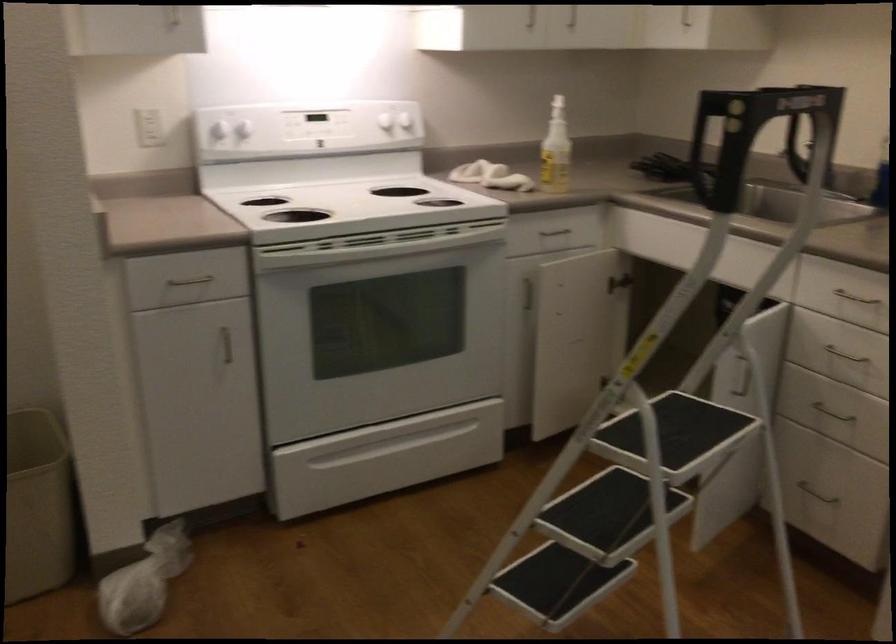
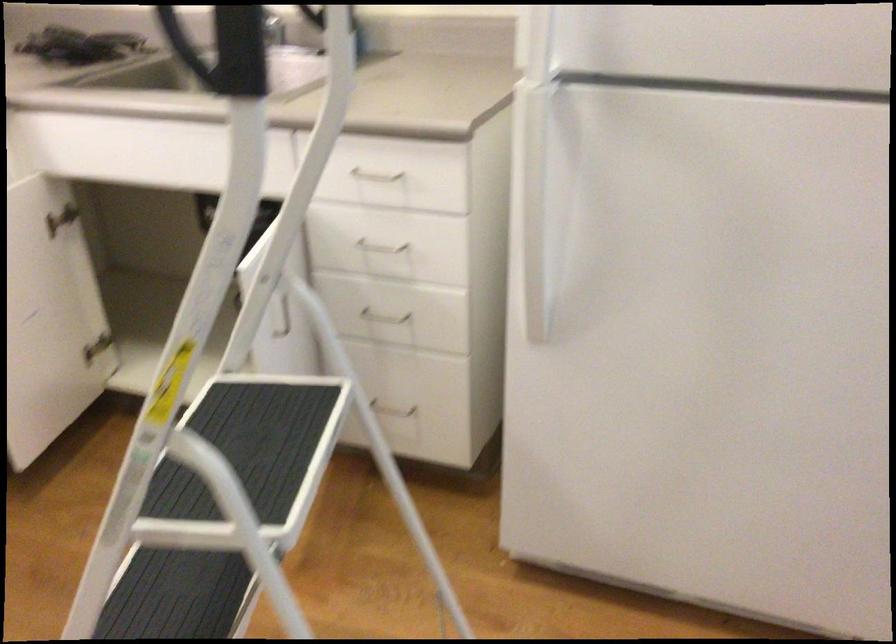
Find the pixel in the second image that matches pixel 734 174 in the first image.

(186, 49)